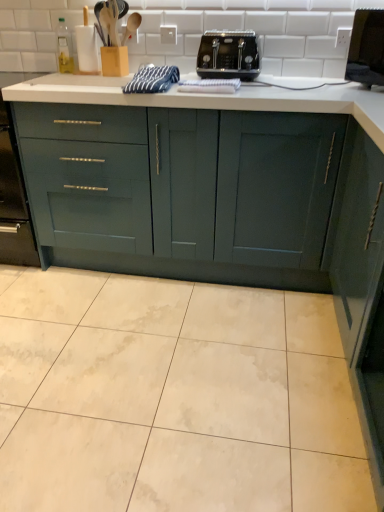
I want to click on free space to the right of black plastic toaster at center, so click(x=294, y=78).